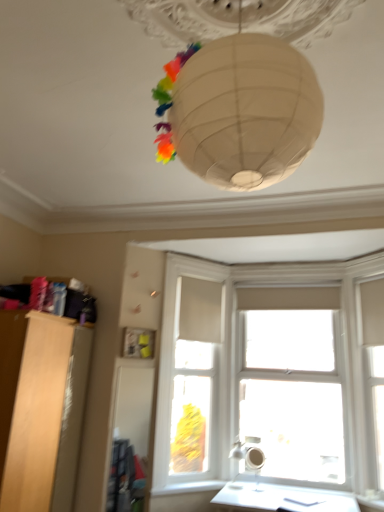
I want to click on vacant region above white matte window frame at right, which is the 1th window frame in right-to-left order (from a real-world perspective), so tap(364, 258).